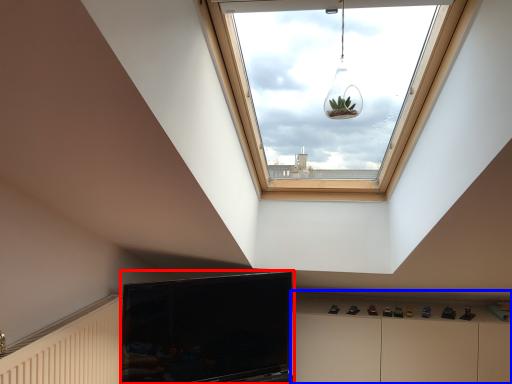
Question: Which of the following is the farthest to the observer, television (highlighted by a red box) or dresser (highlighted by a blue box)?

Choices:
 (A) television
 (B) dresser

Answer: (B)